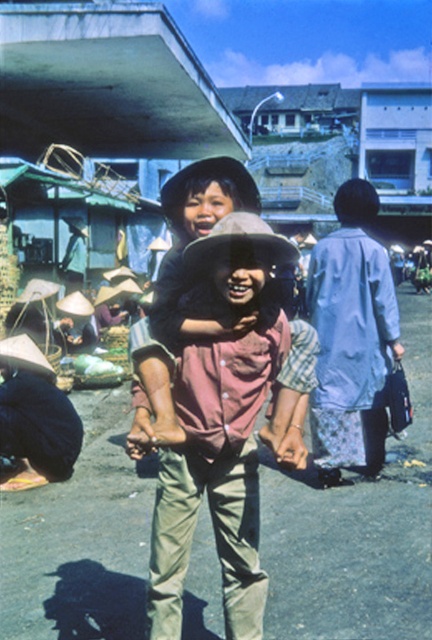
Question: Among these points, which one is nearest to the camera?

Choices:
 (A) (349, 282)
 (B) (172, 480)

Answer: (B)

Question: Can you confirm if smooth concrete overpass at upper left is bigger than pink fabric at center?

Choices:
 (A) yes
 (B) no

Answer: (A)

Question: Which of the following is the farthest from the observer?

Choices:
 (A) pink fabric dress at center
 (B) light blue fabric dress at center

Answer: (B)

Question: Is pink fabric dress at center smaller than light blue fabric dress at center?

Choices:
 (A) yes
 (B) no

Answer: (B)

Question: Where is pink fabric dress at center located in relation to light blue fabric dress at center in the image?

Choices:
 (A) left
 (B) right

Answer: (A)

Question: Which object is closer to the camera taking this photo?

Choices:
 (A) pink fabric at center
 (B) pink fabric dress at center
 (C) smooth concrete overpass at upper left

Answer: (B)